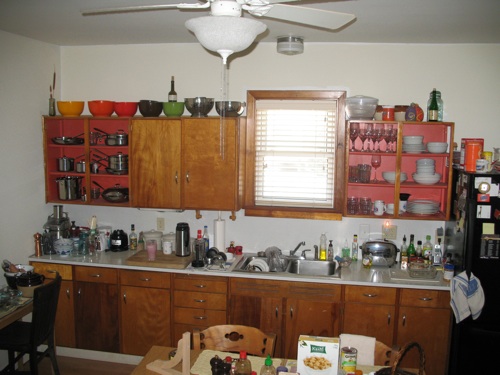
The image size is (500, 375). In order to click on chairs in this screenshot , I will do `click(230, 338)`, `click(382, 347)`, `click(39, 304)`, `click(39, 339)`.